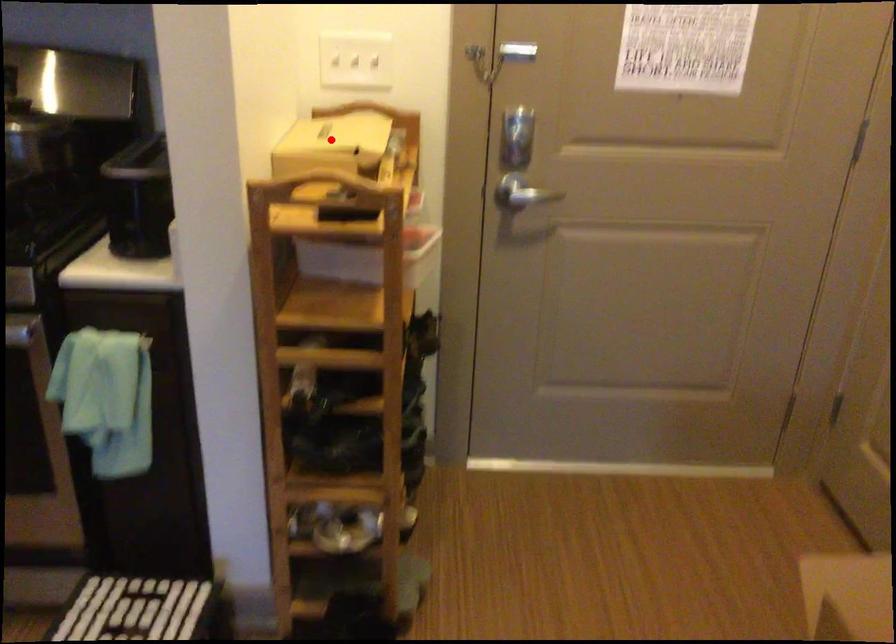
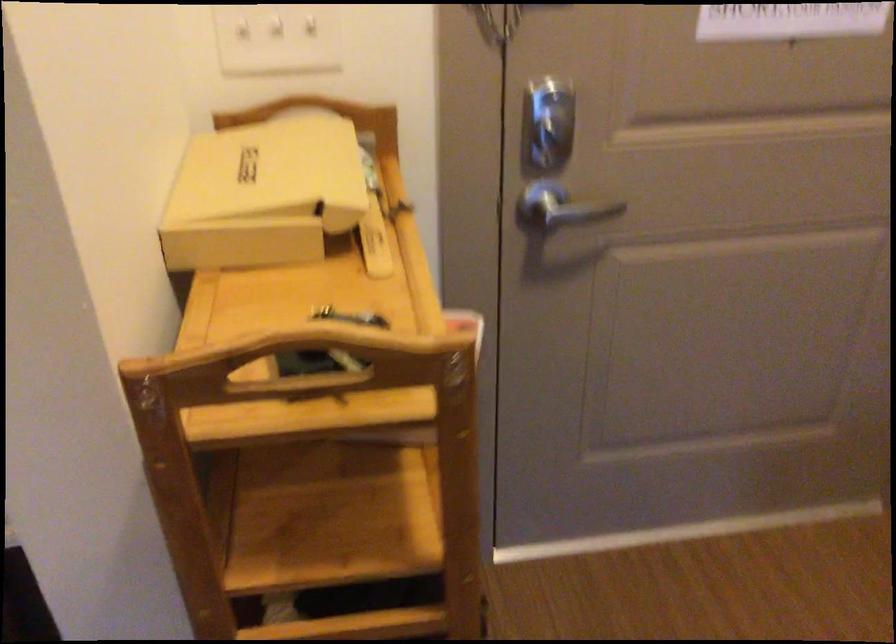
In the second image, find the point that corresponds to the highlighted location in the first image.

(263, 194)